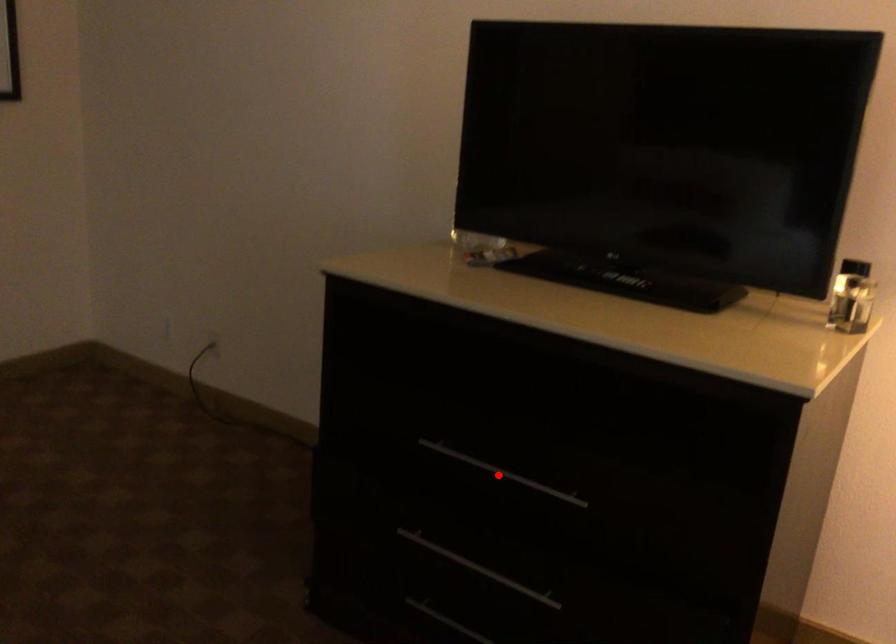
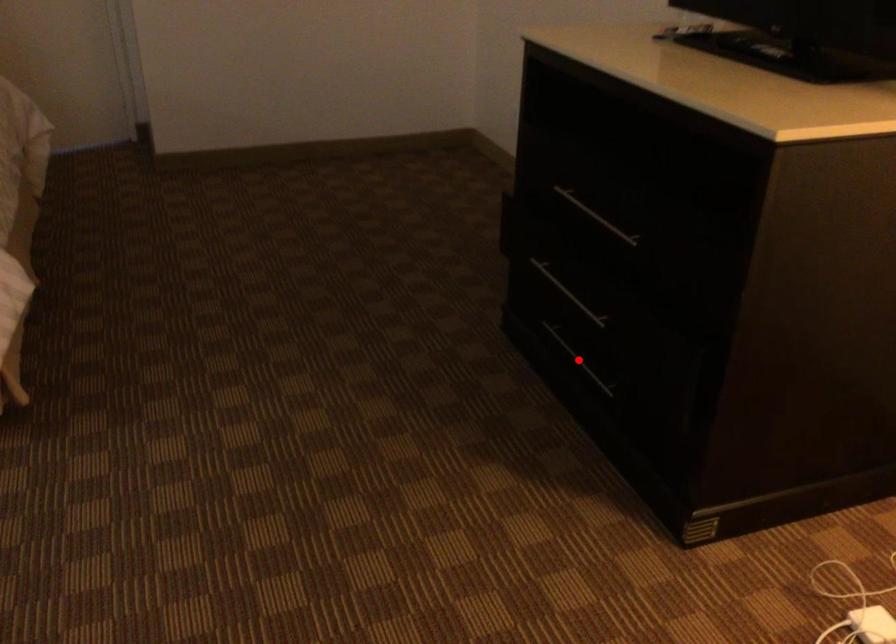
In the scene shown: I am providing you with two images of the same scene from different viewpoints. A red point is marked on the first image and another point is marked on the second image. Is the red point in image1 aligned with the point shown in image2?

No